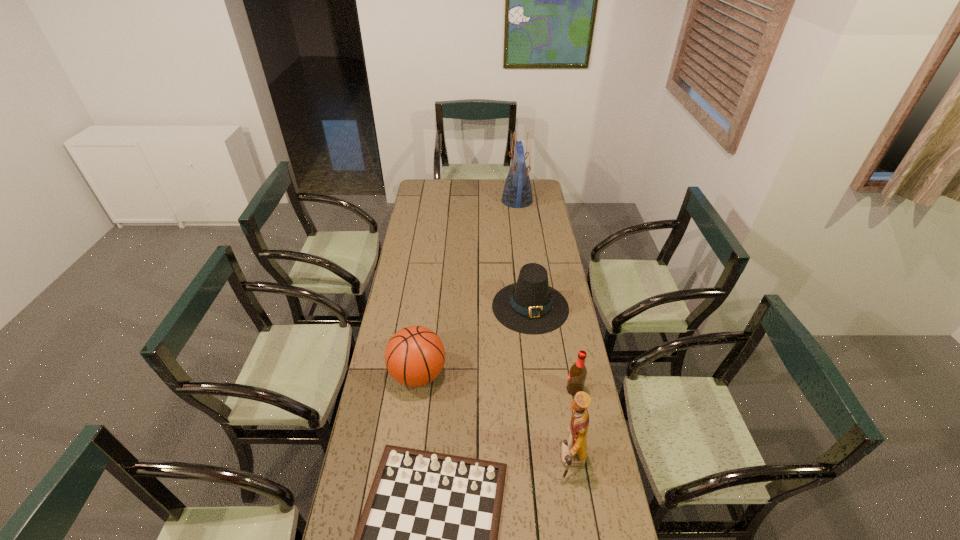
In order to click on the tallest object in this screenshot , I will do `click(517, 193)`.

Locate an element on the screen. The height and width of the screenshot is (540, 960). shopping bag is located at coordinates (517, 193).

Image resolution: width=960 pixels, height=540 pixels. I want to click on the second tallest object, so click(x=573, y=450).

The width and height of the screenshot is (960, 540). In order to click on basketball in this screenshot , I will do `click(414, 356)`.

Identify the location of beer bottle. The image size is (960, 540). (577, 375).

You are a GUI agent. You are given a task and a screenshot of the screen. Output one action in this format:
    pyautogui.click(x=<x>, y=<y>)
    Task: Click on the fifth nearest object
    
    Given the screenshot: What is the action you would take?
    pyautogui.click(x=530, y=306)

The width and height of the screenshot is (960, 540). In order to click on free location located 0.200m on the left of the shopping bag in this screenshot , I will do `click(467, 201)`.

Where is `free location located on the front-facing side of the nutcracker`? The height and width of the screenshot is (540, 960). free location located on the front-facing side of the nutcracker is located at coordinates 516,462.

Where is `vacant space located 0.170m on the front-facing side of the nutcracker`? This screenshot has width=960, height=540. vacant space located 0.170m on the front-facing side of the nutcracker is located at coordinates (503, 462).

The height and width of the screenshot is (540, 960). Identify the location of vacant space located on the front-facing side of the nutcracker. (455, 462).